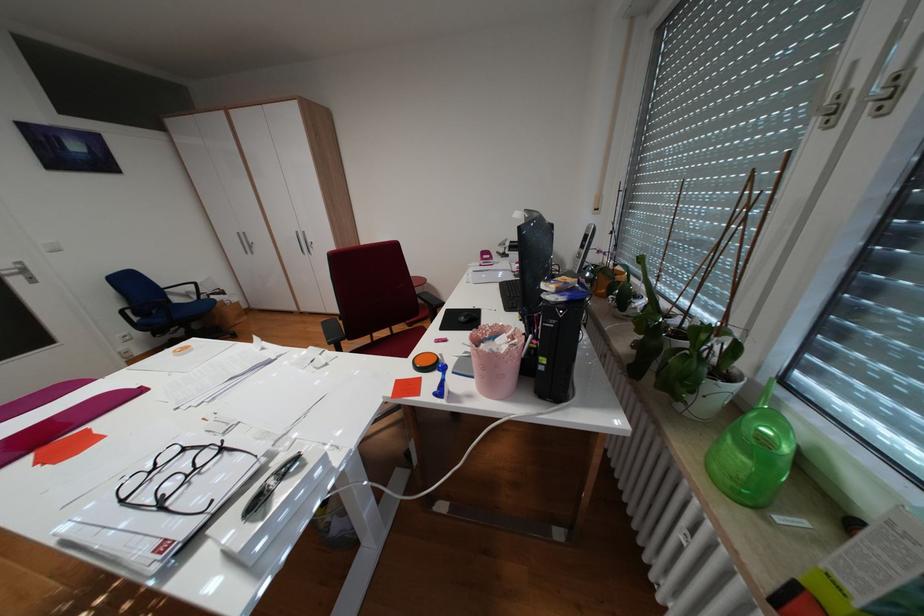
The image size is (924, 616). Describe the element at coordinates (404, 341) in the screenshot. I see `the red chair sitting surface` at that location.